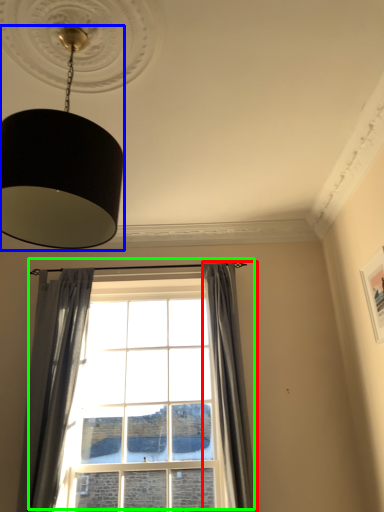
Question: Estimate the real-world distances between objects in this image. Which object is closer to curtain (highlighted by a red box), lamp (highlighted by a blue box) or window (highlighted by a green box)?

Choices:
 (A) lamp
 (B) window

Answer: (B)